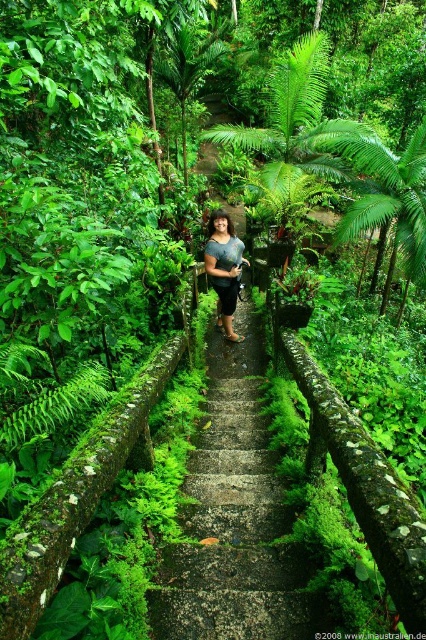
Is green mossy stone steps at center to the left of matte blue shirt at center from the viewer's perspective?

Incorrect, green mossy stone steps at center is not on the left side of matte blue shirt at center.

Who is higher up, green mossy stone steps at center or matte blue shirt at center?

matte blue shirt at center is above.

Which is behind, point (247, 547) or point (216, 212)?

The point (216, 212) is more distant.

Locate an element on the screen. The image size is (426, 640). green mossy stone steps at center is located at coordinates (233, 518).